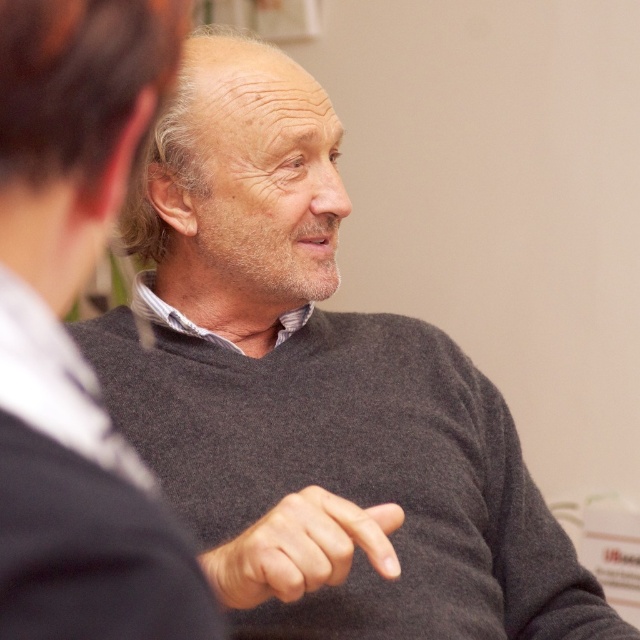
Question: Which point appears farthest from the camera in this image?

Choices:
 (A) (276, 563)
 (B) (186, 10)

Answer: (A)

Question: Is dark gray sweater at center smaller than smooth gray finger at center?

Choices:
 (A) yes
 (B) no

Answer: (A)

Question: Is dark gray sweater at center bigger than smooth gray finger at center?

Choices:
 (A) no
 (B) yes

Answer: (A)

Question: Can you confirm if dark gray sweater at center is positioned below smooth gray finger at center?

Choices:
 (A) yes
 (B) no

Answer: (B)